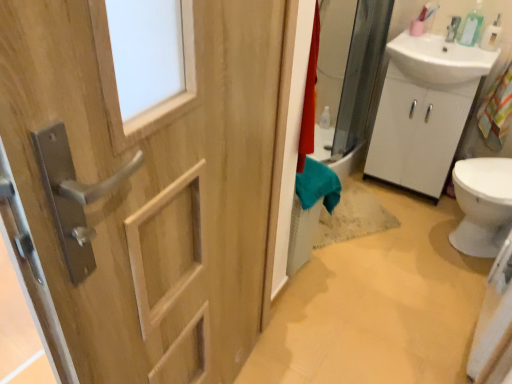
Question: Should I look upward or downward to see white glossy sink at upper right?

Choices:
 (A) up
 (B) down

Answer: (A)

Question: Is white glossy sink at upper right smaller than white matte cabinet at right?

Choices:
 (A) no
 (B) yes

Answer: (B)

Question: Does white glossy sink at upper right turn towards white matte cabinet at right?

Choices:
 (A) no
 (B) yes

Answer: (B)

Question: From a real-world perspective, is white glossy sink at upper right under white matte cabinet at right?

Choices:
 (A) yes
 (B) no

Answer: (B)

Question: Considering the relative positions of white glossy sink at upper right and white matte cabinet at right in the image provided, is white glossy sink at upper right to the left of white matte cabinet at right from the viewer's perspective?

Choices:
 (A) yes
 (B) no

Answer: (A)

Question: From a real-world perspective, is white glossy sink at upper right located higher than white matte cabinet at right?

Choices:
 (A) yes
 (B) no

Answer: (A)

Question: Is white glossy sink at upper right closer to the viewer compared to white matte cabinet at right?

Choices:
 (A) yes
 (B) no

Answer: (A)

Question: From the image's perspective, is white glossy sink at upper right located above clear plastic soap dispenser at upper right?

Choices:
 (A) yes
 (B) no

Answer: (B)

Question: From a real-world perspective, is white glossy sink at upper right over clear plastic soap dispenser at upper right?

Choices:
 (A) yes
 (B) no

Answer: (B)

Question: Is white glossy sink at upper right far away from clear plastic soap dispenser at upper right?

Choices:
 (A) no
 (B) yes

Answer: (A)

Question: Does white glossy sink at upper right have a greater width compared to clear plastic soap dispenser at upper right?

Choices:
 (A) yes
 (B) no

Answer: (A)

Question: Does white glossy sink at upper right have a greater height compared to clear plastic soap dispenser at upper right?

Choices:
 (A) no
 (B) yes

Answer: (B)

Question: Considering the relative sizes of white glossy sink at upper right and clear plastic soap dispenser at upper right in the image provided, is white glossy sink at upper right thinner than clear plastic soap dispenser at upper right?

Choices:
 (A) yes
 (B) no

Answer: (B)

Question: Is natural wood door at left closer to the viewer compared to clear plastic soap dispenser at upper right?

Choices:
 (A) yes
 (B) no

Answer: (A)